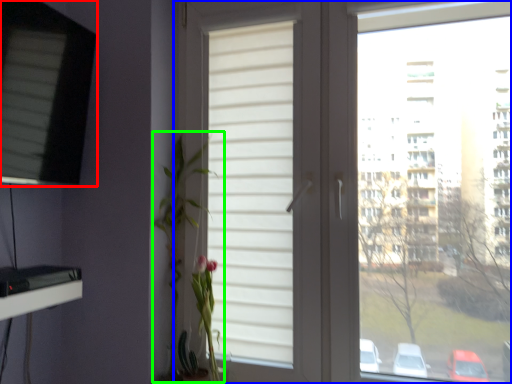
Question: Considering the real-world distances, which object is farthest from window (highlighted by a red box)? window (highlighted by a blue box) or floral arrangement (highlighted by a green box)?

Choices:
 (A) window
 (B) floral arrangement

Answer: (A)